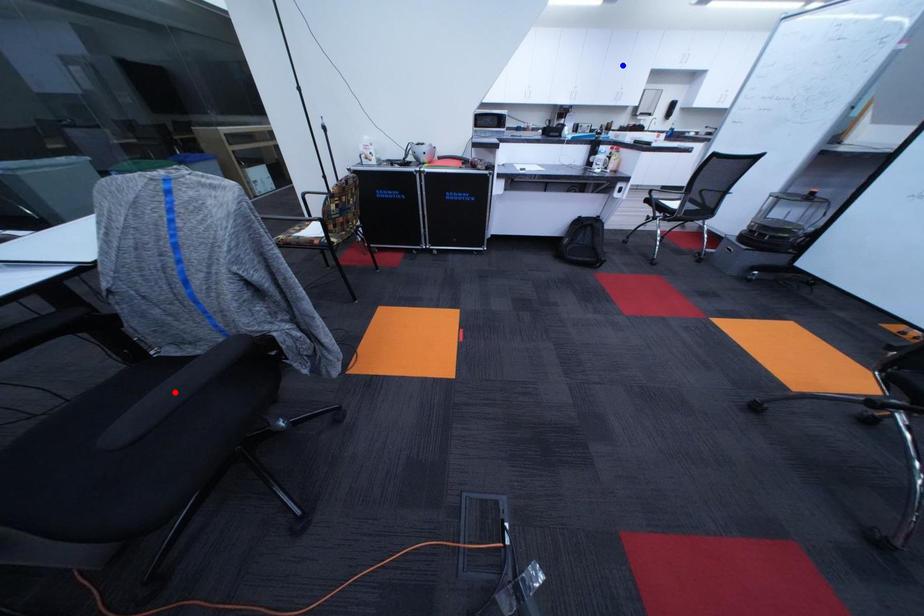
Question: Which of the two points in the image is closer to the camera?

Choices:
 (A) Blue point is closer.
 (B) Red point is closer.

Answer: (B)